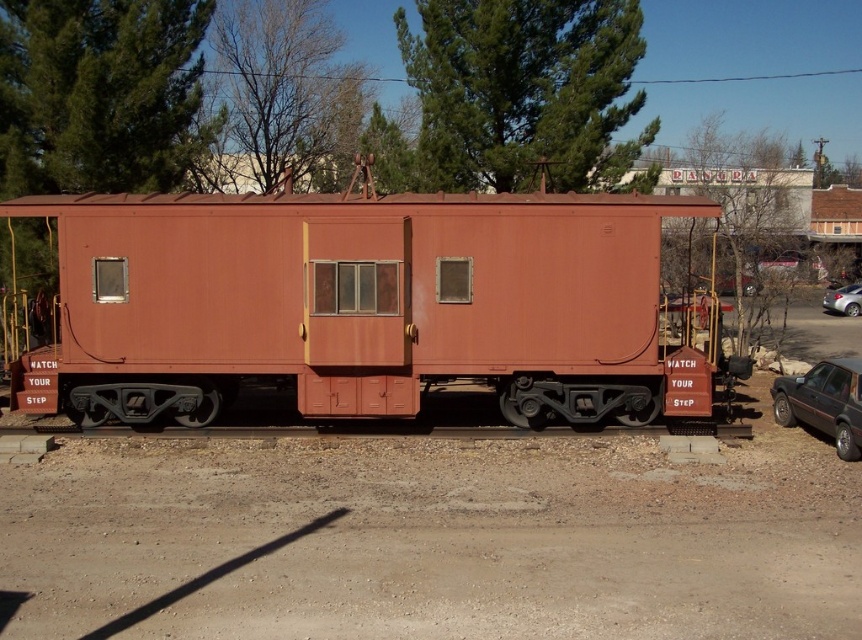
Question: Which object is the closest to the silver metallic car at right?

Choices:
 (A) rusty metal caboose at center
 (B) matte red caboose at center

Answer: (B)

Question: Is rusty metal caboose at center thinner than matte red caboose at center?

Choices:
 (A) no
 (B) yes

Answer: (A)

Question: Based on their relative distances, which object is nearer to the matte red caboose at center?

Choices:
 (A) silver metallic car at right
 (B) rusty metal caboose at center

Answer: (B)

Question: Does rusty metal caboose at center lie behind matte red caboose at center?

Choices:
 (A) yes
 (B) no

Answer: (A)

Question: Is rusty metal caboose at center bigger than matte red caboose at center?

Choices:
 (A) yes
 (B) no

Answer: (A)

Question: Considering the real-world distances, which object is farthest from the matte red caboose at center?

Choices:
 (A) silver metallic car at right
 (B) rusty metal caboose at center

Answer: (A)